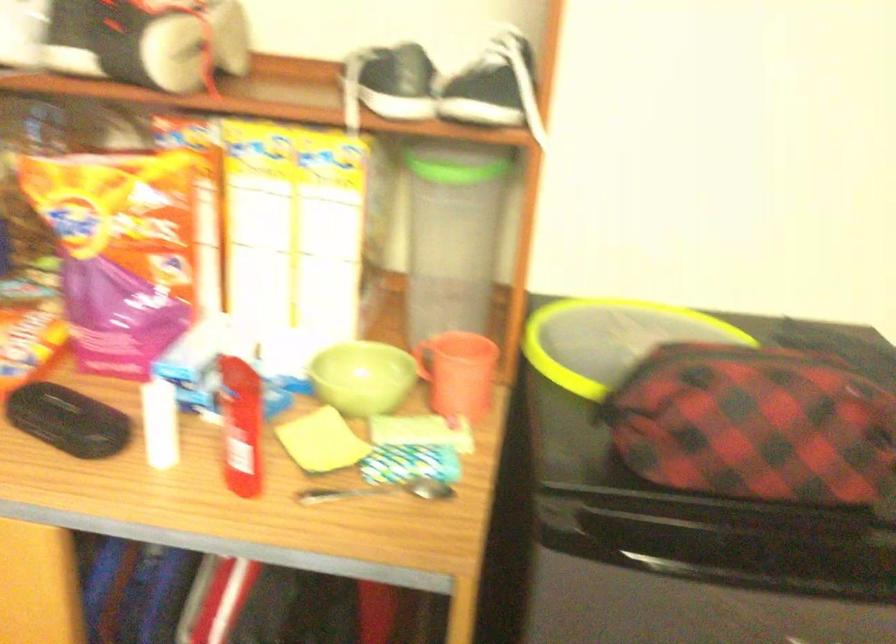
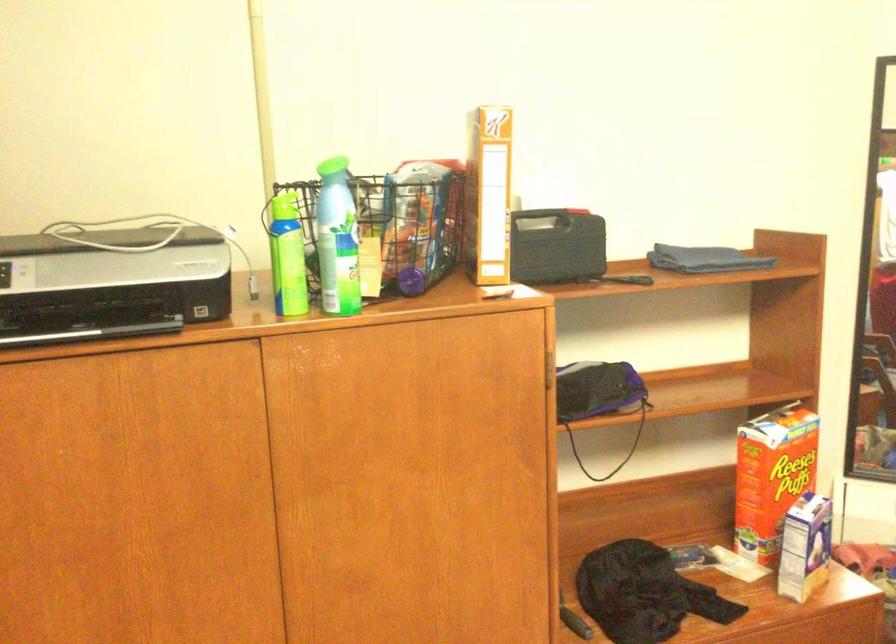
From the picture: The images are taken continuously from a first-person perspective. In which direction is your viewpoint rotating?

The camera rotated toward right-down.